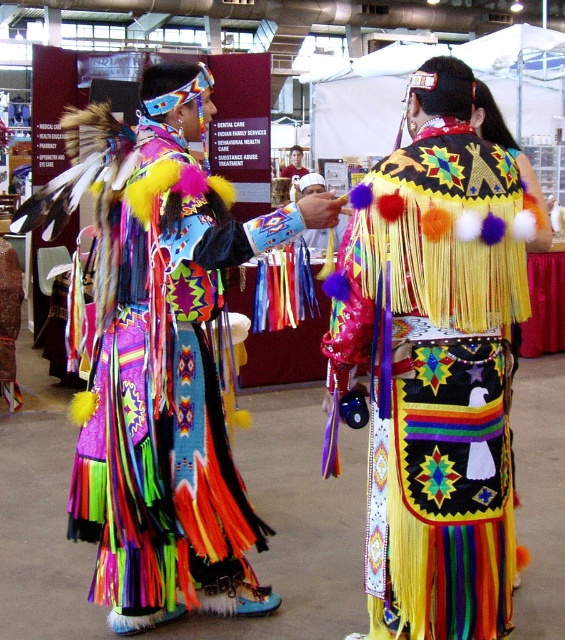
Can you confirm if multicolored fringed dress at center is positioned to the right of multicolored fringed dress at left?

Correct, you'll find multicolored fringed dress at center to the right of multicolored fringed dress at left.

Between point (454, 392) and point (138, 353), which one is positioned in front?

Positioned in front is point (454, 392).

Where is `multicolored fringed dress at center`? The height and width of the screenshot is (640, 565). multicolored fringed dress at center is located at coordinates (436, 376).